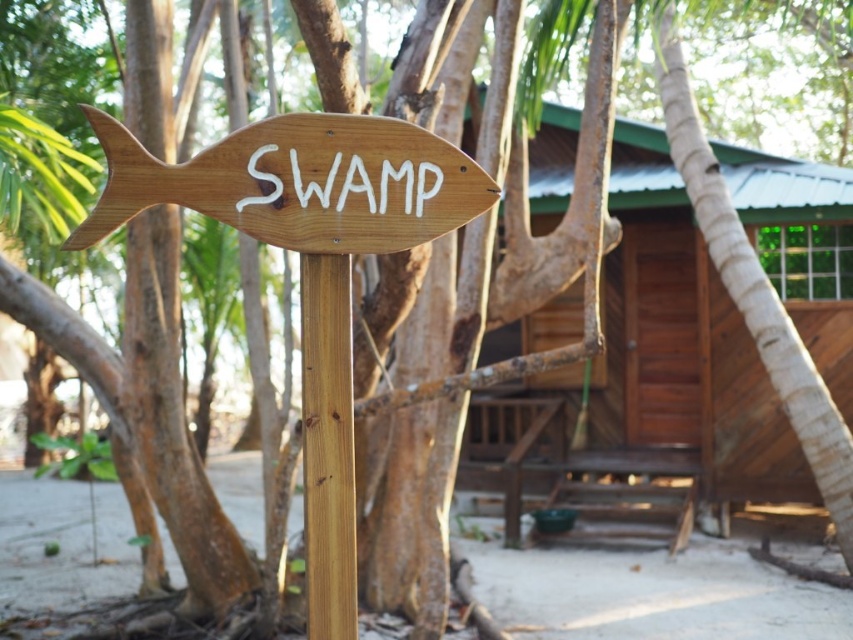
Question: Based on their relative distances, which object is nearer to the light brown wood pole at center?

Choices:
 (A) brown wooden hut at center
 (B) natural wood fish sign at left

Answer: (B)

Question: Does natural wood fish sign at left appear on the right side of light brown wood pole at center?

Choices:
 (A) no
 (B) yes

Answer: (A)

Question: Can you confirm if brown wooden hut at center is positioned below natural wood fish sign at left?

Choices:
 (A) yes
 (B) no

Answer: (A)

Question: Which point is closer to the camera?

Choices:
 (A) light brown wood pole at center
 (B) brown wooden hut at center

Answer: (A)

Question: Considering the relative positions of brown wooden hut at center and light brown wood pole at center in the image provided, where is brown wooden hut at center located with respect to light brown wood pole at center?

Choices:
 (A) above
 (B) below

Answer: (A)

Question: Considering the real-world distances, which object is farthest from the brown wooden hut at center?

Choices:
 (A) natural wood fish sign at left
 (B) light brown wood pole at center

Answer: (B)